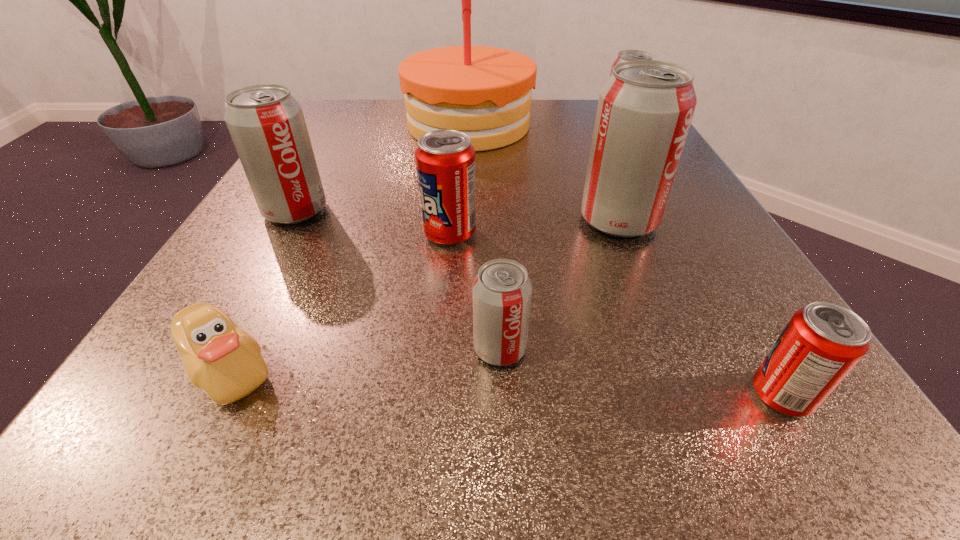
Point out which gray soda can is positioned as the second nearest to the farthest gray soda can. Please provide its 2D coordinates. Your answer should be formatted as a tuple, i.e. [(x, y)], where the tuple contains the x and y coordinates of a point satisfying the conditions above.

[(266, 123)]

I want to click on vacant space that satisfies the following two spatial constraints: 1. on the front side of the tallest object; 2. on the left side of the biggest gray soda can, so click(x=465, y=221).

This screenshot has width=960, height=540. In order to click on vacant space that satisfies the following two spatial constraints: 1. on the back side of the second nearest soda can; 2. on the left side of the second tallest object in this screenshot , I will do `click(494, 221)`.

Where is `vacant space that satisfies the following two spatial constraints: 1. at the beak of the duck; 2. on the left side of the nearest soda can`? This screenshot has height=540, width=960. vacant space that satisfies the following two spatial constraints: 1. at the beak of the duck; 2. on the left side of the nearest soda can is located at coordinates tap(215, 395).